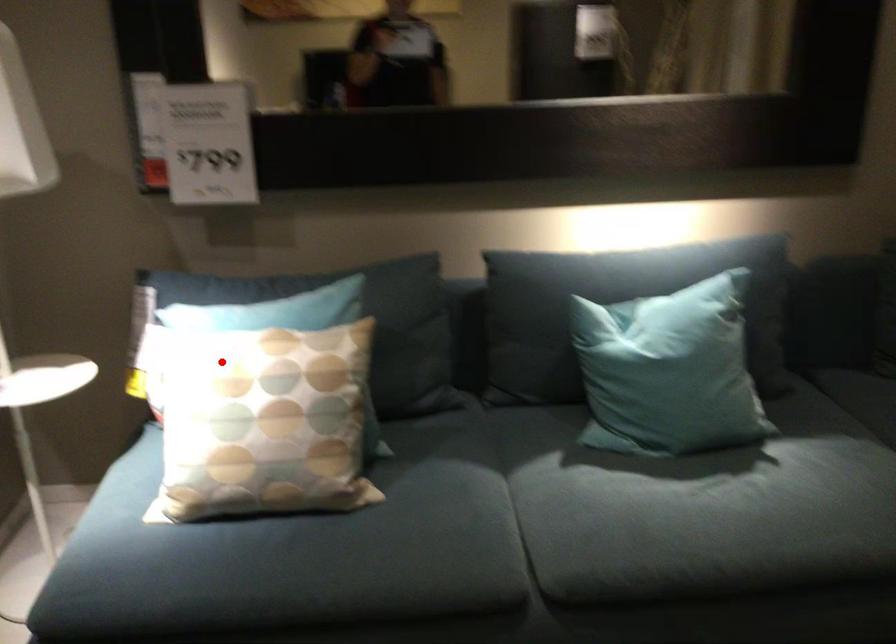
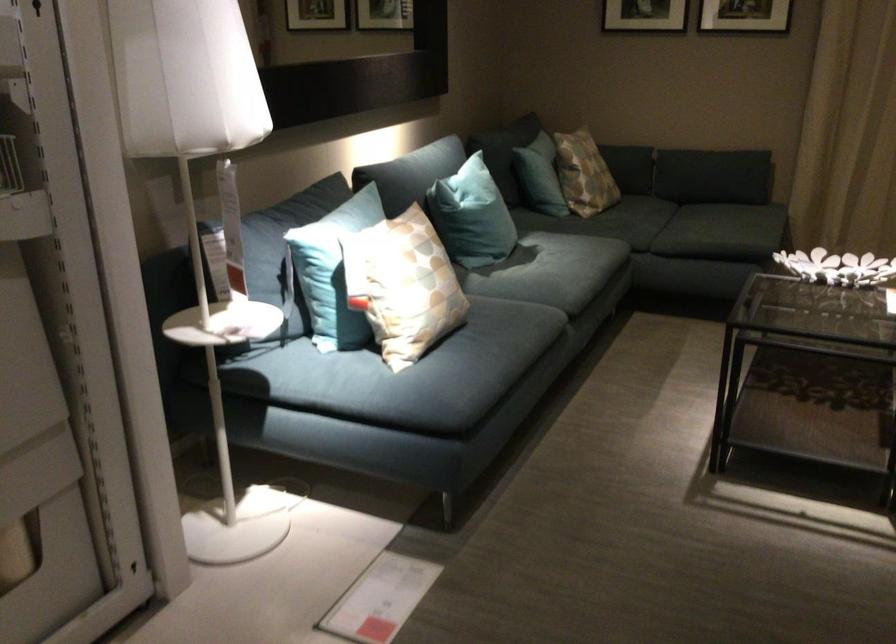
In the second image, find the point that corresponds to the highlighted location in the first image.

(332, 270)